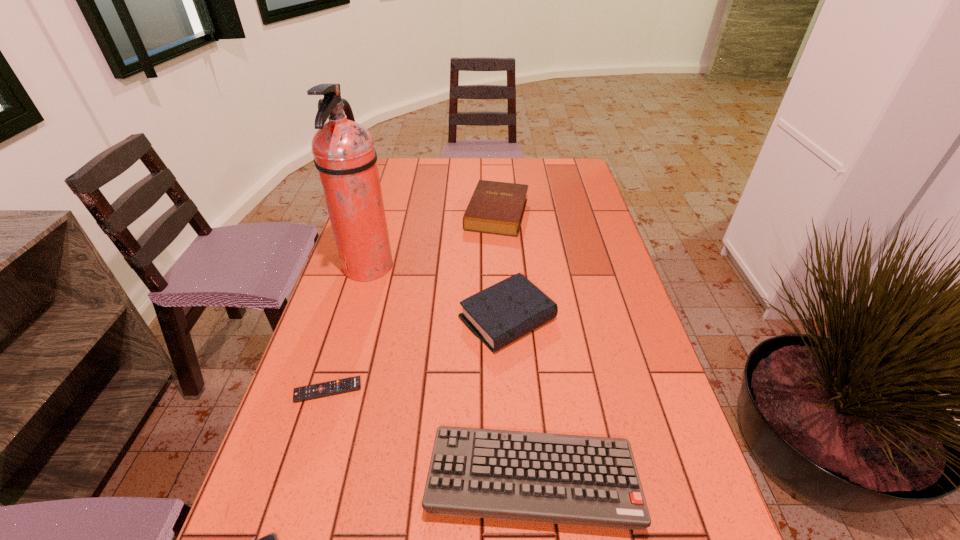
Identify the location of free spot between the farthest object and the tallest object. (432, 241).

Identify the location of free space between the nearer Bible and the computer keyboard. The width and height of the screenshot is (960, 540). (519, 399).

Identify the location of free spot between the farther Bible and the fire extinguisher. The height and width of the screenshot is (540, 960). (432, 241).

The image size is (960, 540). I want to click on object that stands as the fourth closest to the farther Bible, so click(x=499, y=474).

The width and height of the screenshot is (960, 540). What are the coordinates of `object that ranks as the closest to the computer keyboard` in the screenshot? It's located at (271, 539).

Image resolution: width=960 pixels, height=540 pixels. I want to click on vacant space that satisfies the following two spatial constraints: 1. at the nozzle of the tallest object; 2. on the back side of the nearer Bible, so click(352, 319).